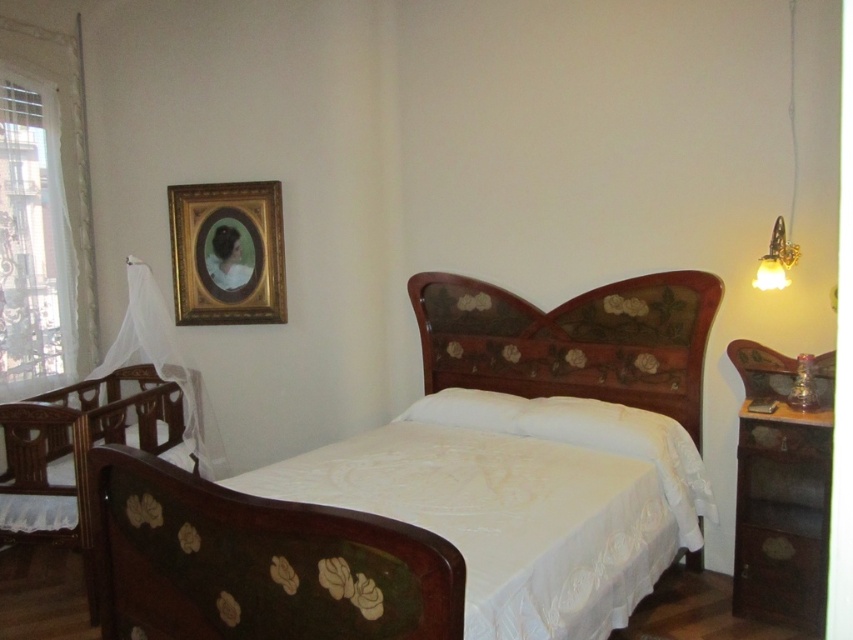
Question: Can you confirm if wooden bed at center is positioned above gold/gilded picture frame at upper left?

Choices:
 (A) no
 (B) yes

Answer: (A)

Question: Which point is farther to the camera?

Choices:
 (A) (685, 541)
 (B) (157, 381)

Answer: (B)

Question: Which point is closer to the camera?

Choices:
 (A) wooden bed at center
 (B) wooden dresser at right

Answer: (A)

Question: Considering the relative positions of wooden bed at center and wooden crib at left in the image provided, where is wooden bed at center located with respect to wooden crib at left?

Choices:
 (A) left
 (B) right

Answer: (B)

Question: Which point appears farthest from the camera in this image?

Choices:
 (A) (178, 248)
 (B) (32, 522)
 (C) (712, 298)
 (D) (35, 266)

Answer: (A)

Question: Does woodenheadboard at center come behind gold/gilded picture frame at upper left?

Choices:
 (A) no
 (B) yes

Answer: (A)